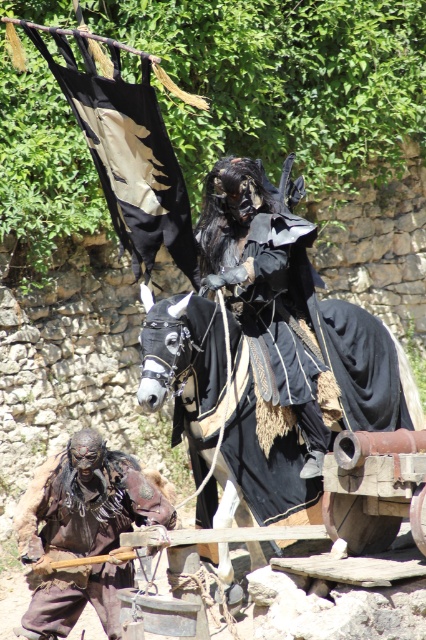
You are a stagehand responsible for setting up the next scene. The director has asked you to move the black leather horse at center closer to the black matte costume at center by 2 meters. Given their current distance, is this adjustment feasible?

The black leather horse at center is currently 7.21 meters away from the black matte costume at center. Moving it closer by 2 meters would reduce the distance to 5.21 meters, which is feasible as it maintains a reasonable spacing for stage setup.

You are a stage director planning the layout for a play. The stage has a coordinate system where the bottom left corner is the origin. The black leather horse at center is positioned at coordinates approximately 0.647 on the x and 0.512 on the y. If you need to place a spotlight directly above the horse, where should you position it in terms of coordinates?

To position a spotlight directly above the black leather horse at center, you should place it at the same x coordinate of 0.647 and a lower y coordinate since the stage coordinate system has the origin at the bottom left. Since the horse is at y 0.512, moving directly above would decrease the y value. For example, placing the spotlight at approximately x 0.647 and y 0.4 would be directly above the horse.

Based on the photo, you are a stage designer planning to move the black leather horse at center and the rusty metal armor at lower left closer to the audience. Which object should you move first to ensure there is enough space for both without overlapping?

You should move the black leather horse at center first because it occupies less space than the rusty metal armor at lower left, allowing more room to maneuver both objects without overlapping.